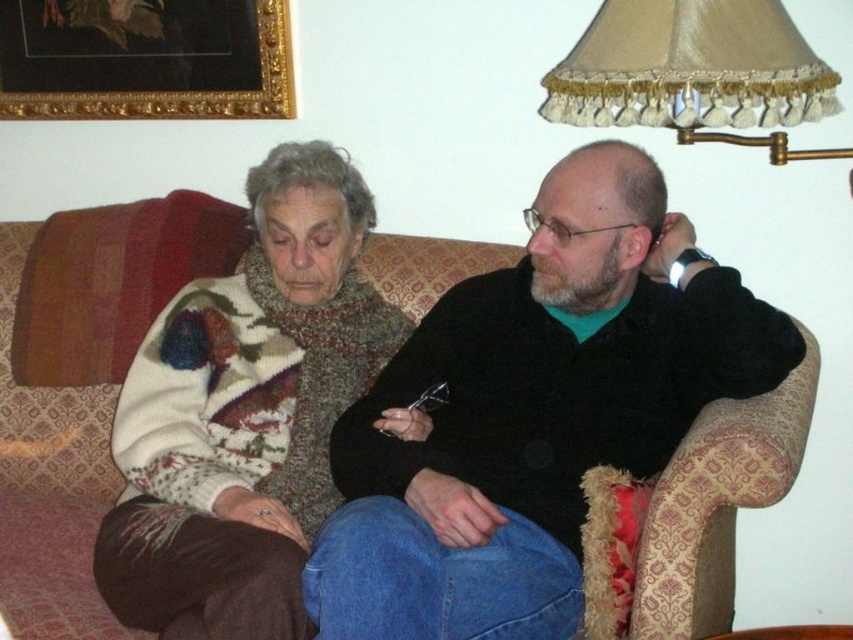
You are a photographer setting up a shoot in the living room. You need to position a tripod to capture both the black matte jacket at center and the beige satin lampshade at upper right in the same frame. Based on their positions, will the lampshade appear above or below the jacket in the photo?

The black matte jacket at center is located below the beige satin lampshade at upper right, so the lampshade will appear above the jacket in the photo.